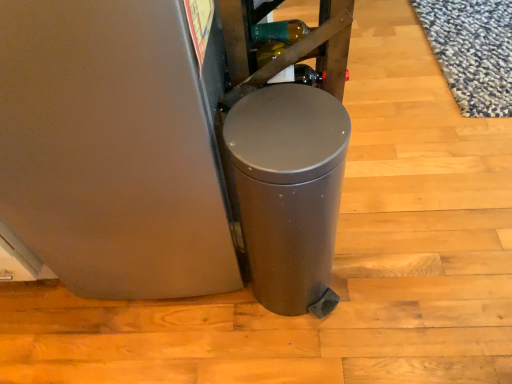
Identify the location of free point in front of satin metallic trash can at center. (306, 354).